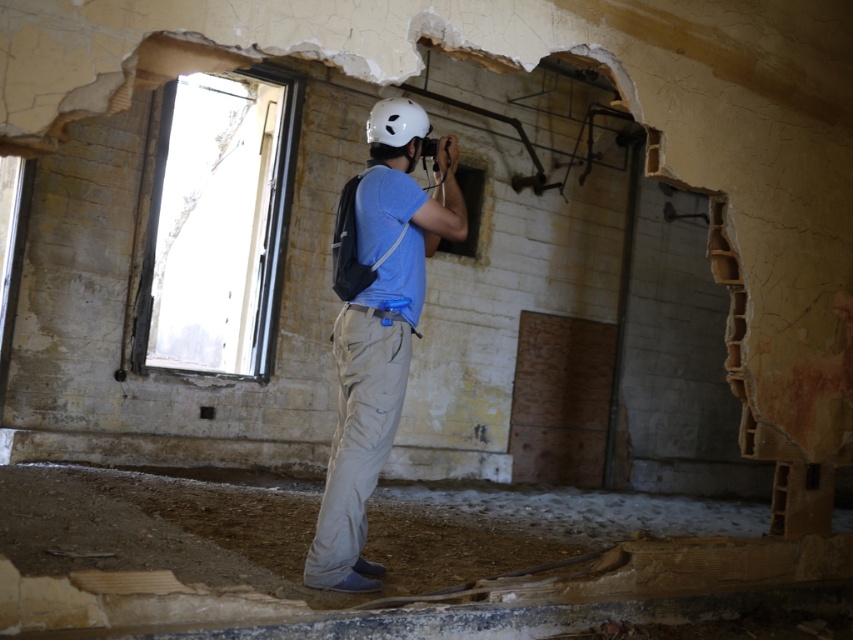
Does matte blue shirt at center appear on the right side of smooth concrete hole at center?

In fact, matte blue shirt at center is to the left of smooth concrete hole at center.

Between matte blue shirt at center and smooth concrete hole at center, which one appears on the right side from the viewer's perspective?

Positioned to the right is smooth concrete hole at center.

Locate an element on the screen. matte blue shirt at center is located at coordinates (379, 330).

Can you confirm if matte blue shirt at center is positioned to the left of white matte helmet at center?

No, matte blue shirt at center is not to the left of white matte helmet at center.

Between matte blue shirt at center and white matte helmet at center, which one is positioned higher?

Positioned higher is white matte helmet at center.

At what (x,y) coordinates should I click in order to perform the action: click on matte blue shirt at center. Please return your answer as a coordinate pair (x, y). The height and width of the screenshot is (640, 853). Looking at the image, I should click on (379, 330).

Who is taller, white matte helmet at center or smooth concrete hole at center?

smooth concrete hole at center

What do you see at coordinates (395, 122) in the screenshot? The width and height of the screenshot is (853, 640). I see `white matte helmet at center` at bounding box center [395, 122].

Identify the location of white matte helmet at center. This screenshot has height=640, width=853. (395, 122).